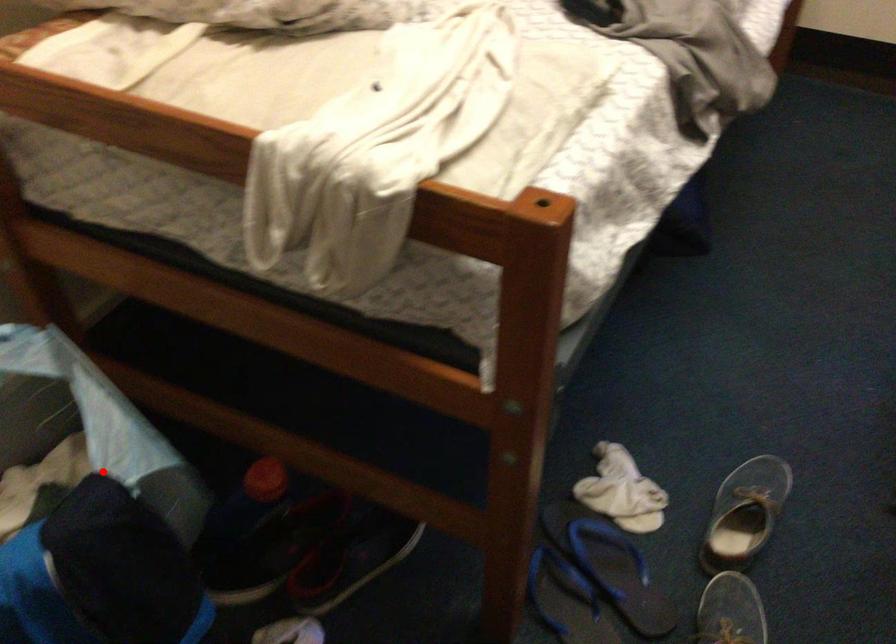
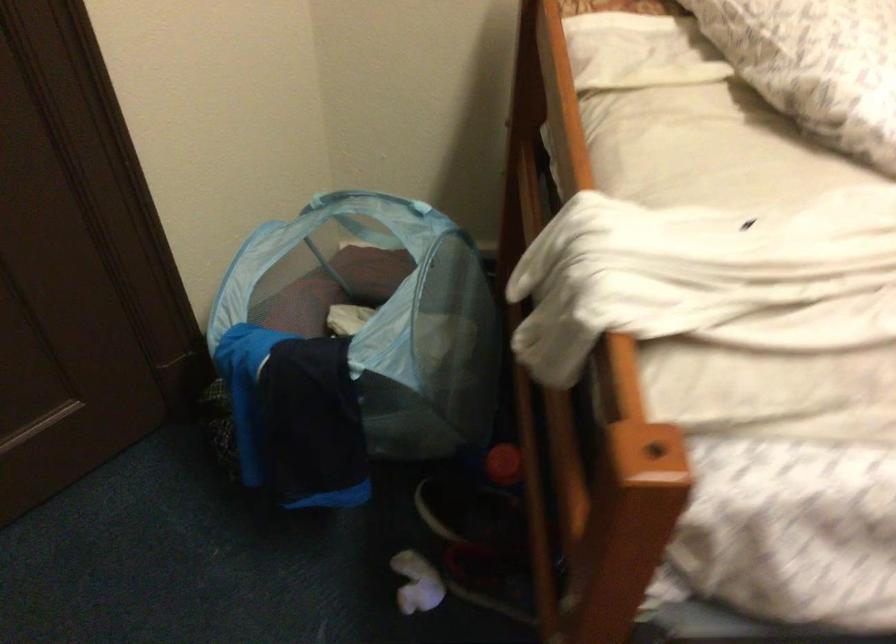
Question: I am providing you with two images of the same scene from different viewpoints. Given a red point in image1, look at the same physical point in image2. Is it:

Choices:
 (A) Closer to the viewpoint
 (B) Farther from the viewpoint

Answer: (B)